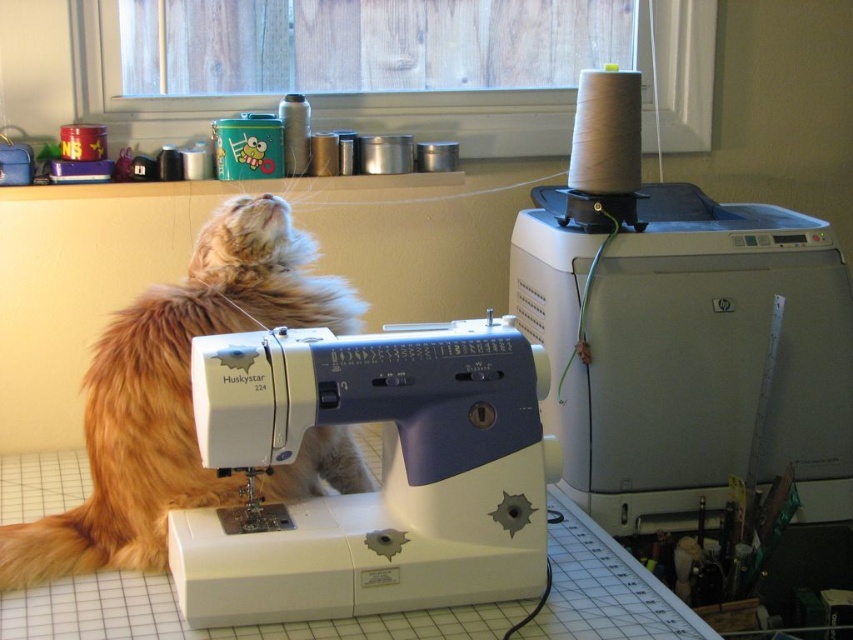
Question: Among these points, which one is farthest from the camera?

Choices:
 (A) (750, 380)
 (B) (103, 490)

Answer: (A)

Question: Which of these objects is positioned farthest from the white plastic sewing machine at center?

Choices:
 (A) matte gray printer at upper right
 (B) fuzzy orange cat at upper left

Answer: (A)

Question: Is matte gray printer at upper right positioned before fuzzy orange cat at upper left?

Choices:
 (A) yes
 (B) no

Answer: (B)

Question: Is white plastic sewing machine at center bigger than fuzzy orange cat at upper left?

Choices:
 (A) yes
 (B) no

Answer: (B)

Question: Is matte gray printer at upper right to the right of fuzzy orange cat at upper left from the viewer's perspective?

Choices:
 (A) yes
 (B) no

Answer: (A)

Question: Estimate the real-world distances between objects in this image. Which object is closer to the fuzzy orange cat at upper left?

Choices:
 (A) white plastic sewing machine at center
 (B) matte gray printer at upper right

Answer: (A)